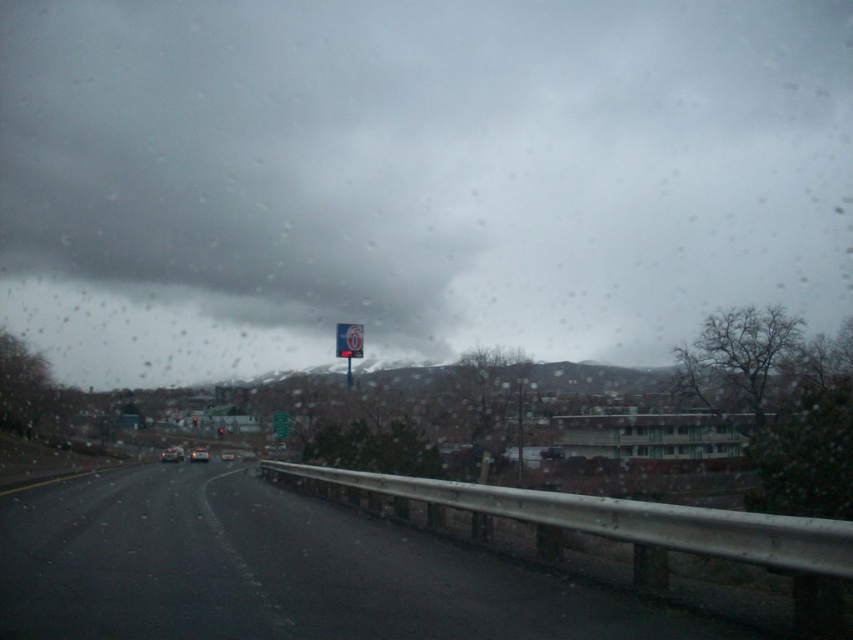
Question: Is gray cloudy sky at upper center wider than shiny silver sedan at center?

Choices:
 (A) no
 (B) yes

Answer: (B)

Question: Among these points, which one is farthest from the camera?

Choices:
 (A) (167, 461)
 (B) (219, 436)

Answer: (B)

Question: Which point is farther to the camera?

Choices:
 (A) (189, 458)
 (B) (177, 449)

Answer: (B)

Question: Does silver metallic car at center appear on the left side of red glass traffic light at center?

Choices:
 (A) no
 (B) yes

Answer: (B)

Question: Estimate the real-world distances between objects in this image. Which object is farther from the white plastic sign at center?

Choices:
 (A) gray cloudy sky at upper center
 (B) silver metallic car at center
 (C) red glass traffic light at center

Answer: (A)

Question: Is the position of silver metallic car at center more distant than that of red glass traffic light at center?

Choices:
 (A) no
 (B) yes

Answer: (A)